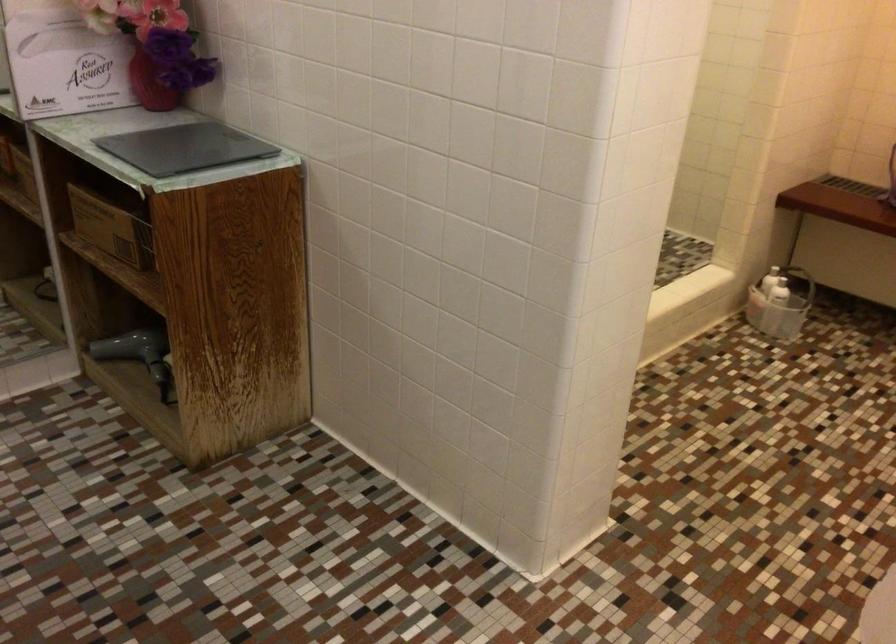
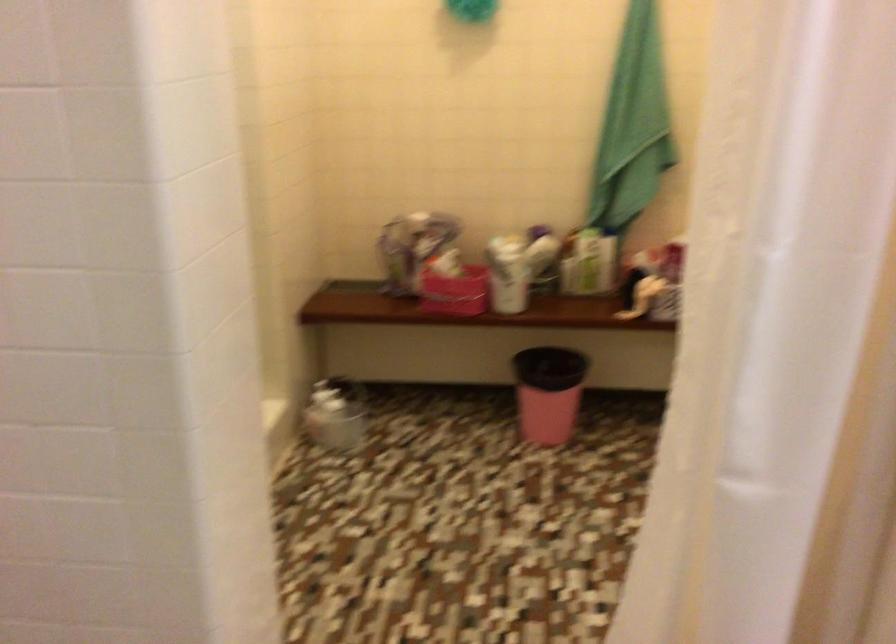
Question: How did the camera likely rotate?

Choices:
 (A) Left
 (B) Right
 (C) Up
 (D) Down

Answer: (B)